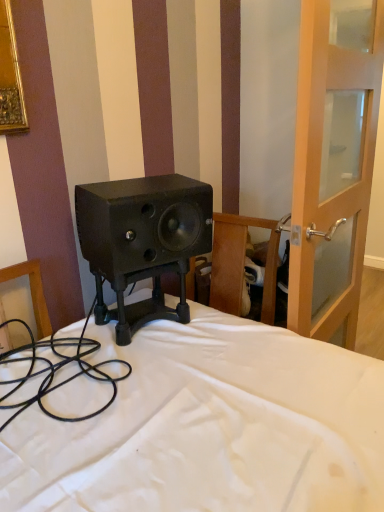
Question: From the image's perspective, would you say black matte speaker at center is positioned over transparent glass door at right?

Choices:
 (A) yes
 (B) no

Answer: (B)

Question: Does black matte speaker at center lie behind transparent glass door at right?

Choices:
 (A) yes
 (B) no

Answer: (A)

Question: Is the depth of black matte speaker at center less than that of transparent glass door at right?

Choices:
 (A) yes
 (B) no

Answer: (B)

Question: Is black matte speaker at center to the left of transparent glass door at right from the viewer's perspective?

Choices:
 (A) no
 (B) yes

Answer: (B)

Question: Can you confirm if black matte speaker at center is shorter than transparent glass door at right?

Choices:
 (A) no
 (B) yes

Answer: (B)

Question: Do you think black matte speaker at center is within black rubber cable at lower left, or outside of it?

Choices:
 (A) inside
 (B) outside

Answer: (B)

Question: From a real-world perspective, relative to black rubber cable at lower left, is black matte speaker at center vertically above or below?

Choices:
 (A) below
 (B) above

Answer: (B)

Question: Considering the positions of point (193, 224) and point (54, 366), is point (193, 224) closer or farther from the camera than point (54, 366)?

Choices:
 (A) farther
 (B) closer

Answer: (A)

Question: In terms of width, does black matte speaker at center look wider or thinner when compared to black rubber cable at lower left?

Choices:
 (A) wide
 (B) thin

Answer: (B)

Question: Is transparent glass door at right in front of or behind black rubber cable at lower left in the image?

Choices:
 (A) front
 (B) behind

Answer: (B)

Question: Is transparent glass door at right to the left or to the right of black rubber cable at lower left in the image?

Choices:
 (A) right
 (B) left

Answer: (A)

Question: Is transparent glass door at right bigger or smaller than black rubber cable at lower left?

Choices:
 (A) small
 (B) big

Answer: (B)

Question: Does point (347, 279) appear closer or farther from the camera than point (19, 411)?

Choices:
 (A) farther
 (B) closer

Answer: (A)

Question: Considering the positions of black matte speaker at center and transparent glass door at right in the image, is black matte speaker at center wider or thinner than transparent glass door at right?

Choices:
 (A) thin
 (B) wide

Answer: (B)

Question: Considering the positions of black matte speaker at center and transparent glass door at right in the image, is black matte speaker at center bigger or smaller than transparent glass door at right?

Choices:
 (A) small
 (B) big

Answer: (A)